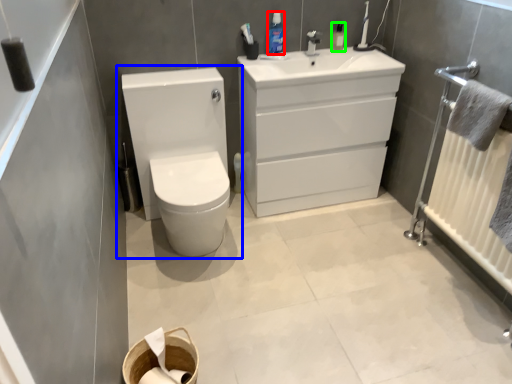
Question: Which is farther away from mouthwash (highlighted by a red box)? toilet (highlighted by a blue box) or mouthwash (highlighted by a green box)?

Choices:
 (A) toilet
 (B) mouthwash

Answer: (A)